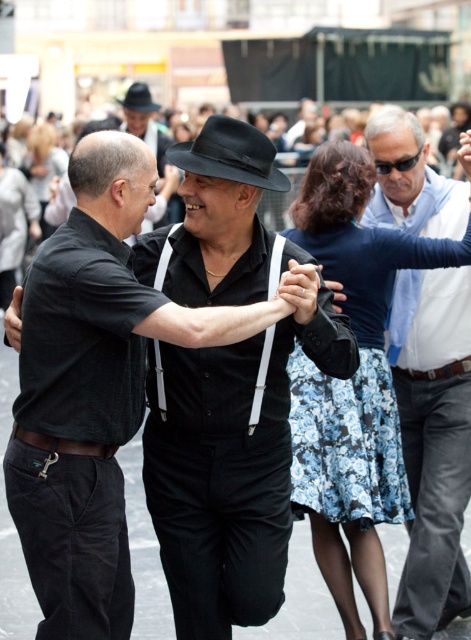
You are a fashion designer observing the dancers in the lively street scene. You notice the black matte suspenders at center and the black leather belt at lower right. Which accessory is bigger in size?

The black matte suspenders at center has a larger size compared to the black leather belt at lower right.

You are a fashion designer observing the dancers in the lively street scene. You need to determine which clothing item is higher positioned between the black matte suspenders at center and the black leather belt at lower right. Which one is higher?

The black matte suspenders at center is taller than black leather belt at lower right, so the black matte suspenders at center is higher positioned.

You are standing in the street scene and want to walk towards the two points. Which point, point (205,499) or point (127,100), will you reach first?

Point (205,499) is closer to the viewer than point (127,100), so you will reach point (205,499) first.